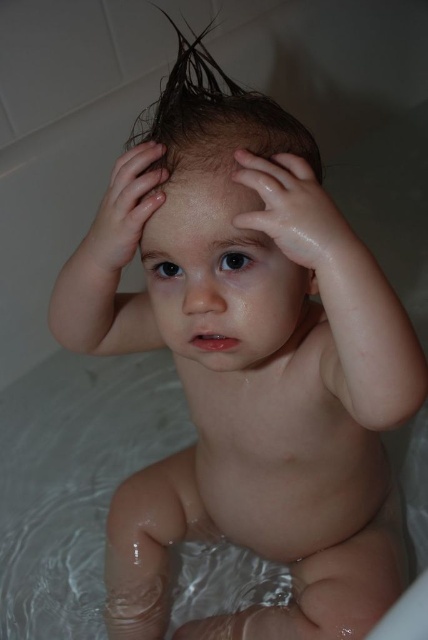
Question: Which object appears closest to the camera in this image?

Choices:
 (A) wet brown hair at upper center
 (B) glossy skin hand at upper center

Answer: (A)

Question: In this image, where is wet brown hair at upper center located relative to glossy wet hand at center?

Choices:
 (A) above
 (B) below

Answer: (A)

Question: Estimate the real-world distances between objects in this image. Which object is farther from the glossy skin hand at upper center?

Choices:
 (A) glossy wet hand at center
 (B) wet brown hair at upper center

Answer: (B)

Question: Is glossy wet hand at center closer to camera compared to glossy skin hand at upper center?

Choices:
 (A) no
 (B) yes

Answer: (B)

Question: Is glossy wet hand at center positioned before glossy skin hand at upper center?

Choices:
 (A) yes
 (B) no

Answer: (A)

Question: Which of the following is the closest to the observer?

Choices:
 (A) (291, 205)
 (B) (103, 220)

Answer: (A)